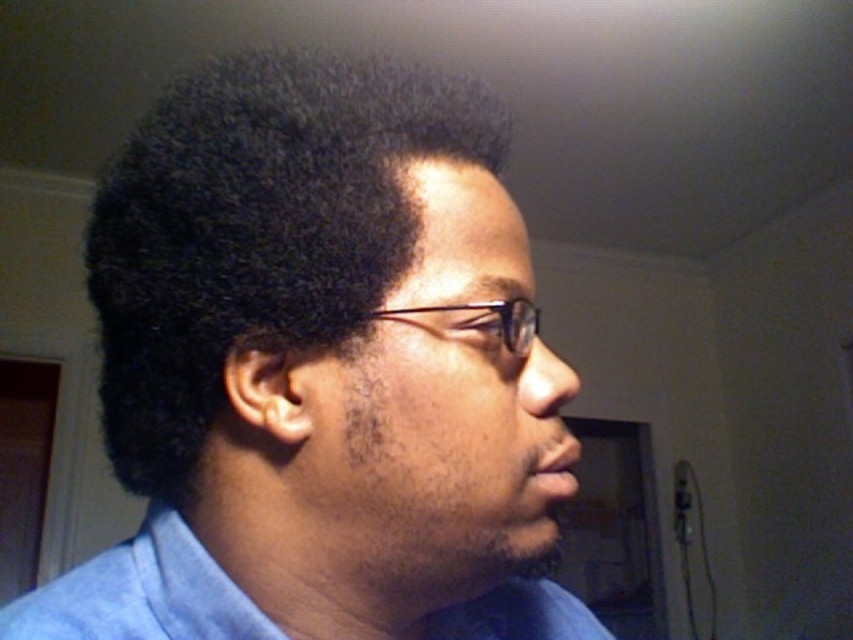
Question: Considering the relative positions of blue cotton dress shirt at lower center and clear plastic glasses at center in the image provided, where is blue cotton dress shirt at lower center located with respect to clear plastic glasses at center?

Choices:
 (A) right
 (B) left

Answer: (B)

Question: Estimate the real-world distances between objects in this image. Which object is farther from the black matte afro at center?

Choices:
 (A) clear plastic glasses at center
 (B) blue cotton dress shirt at lower center

Answer: (B)

Question: Can you confirm if black matte afro at center is wider than clear plastic glasses at center?

Choices:
 (A) no
 (B) yes

Answer: (B)

Question: Can you confirm if black matte afro at center is bigger than clear plastic glasses at center?

Choices:
 (A) no
 (B) yes

Answer: (B)

Question: Which point is farther from the camera taking this photo?

Choices:
 (A) (183, 547)
 (B) (521, 312)

Answer: (A)

Question: Which point is farther from the camera taking this photo?

Choices:
 (A) (505, 320)
 (B) (560, 612)
 (C) (287, 138)

Answer: (B)